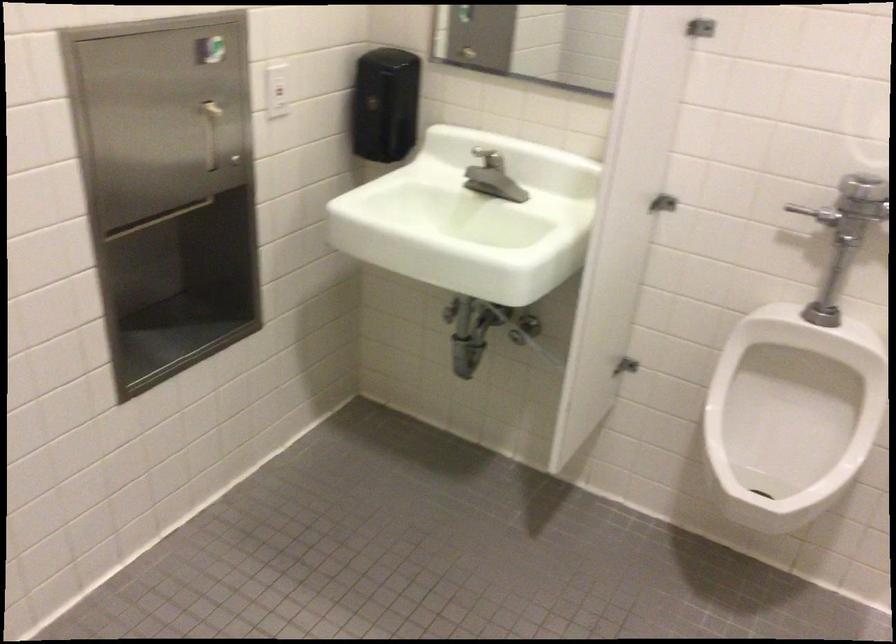
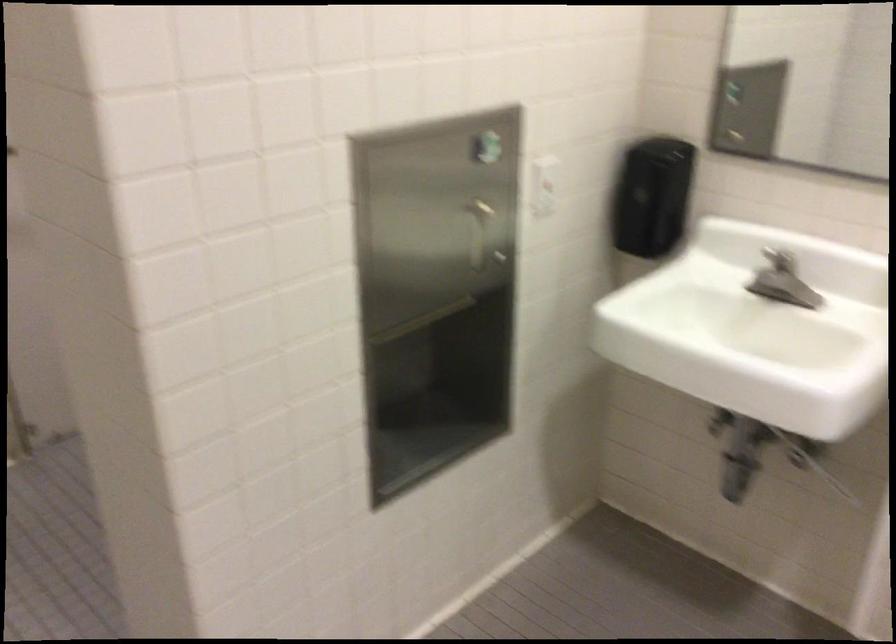
The point at (486, 158) is marked in the first image. Where is the corresponding point in the second image?

(778, 259)